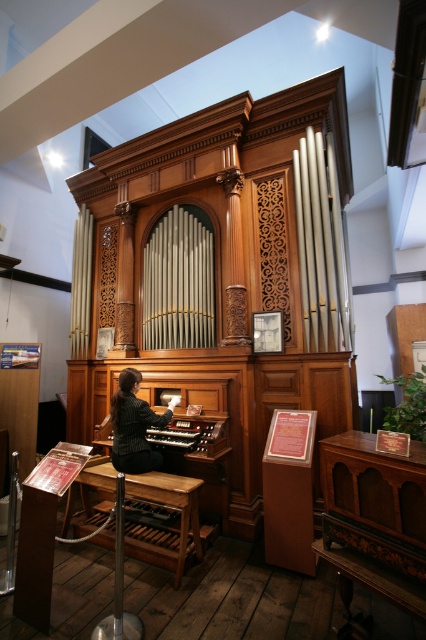
Question: From the image, what is the correct spatial relationship of black striped blazer at center in relation to wooden organ at center?

Choices:
 (A) above
 (B) below

Answer: (A)

Question: Which object appears closest to the camera in this image?

Choices:
 (A) black striped blazer at center
 (B) wooden organ at center

Answer: (A)

Question: Is black striped blazer at center above wooden organ at center?

Choices:
 (A) no
 (B) yes

Answer: (B)

Question: Among these objects, which one is nearest to the camera?

Choices:
 (A) wooden organ at center
 (B) black striped blazer at center

Answer: (B)

Question: Which object appears farthest from the camera in this image?

Choices:
 (A) black striped blazer at center
 (B) wooden organ at center

Answer: (B)

Question: Does black striped blazer at center appear over wooden organ at center?

Choices:
 (A) yes
 (B) no

Answer: (A)